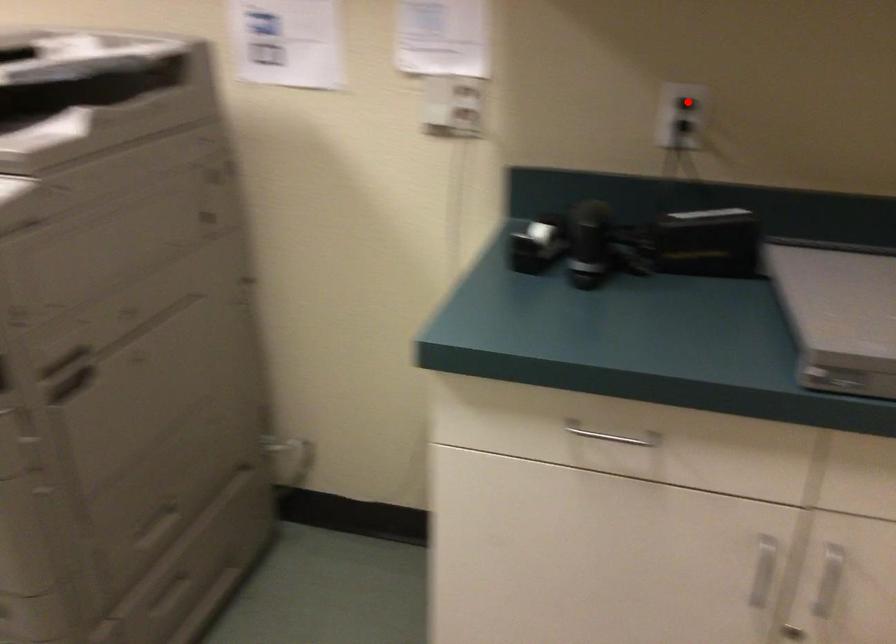
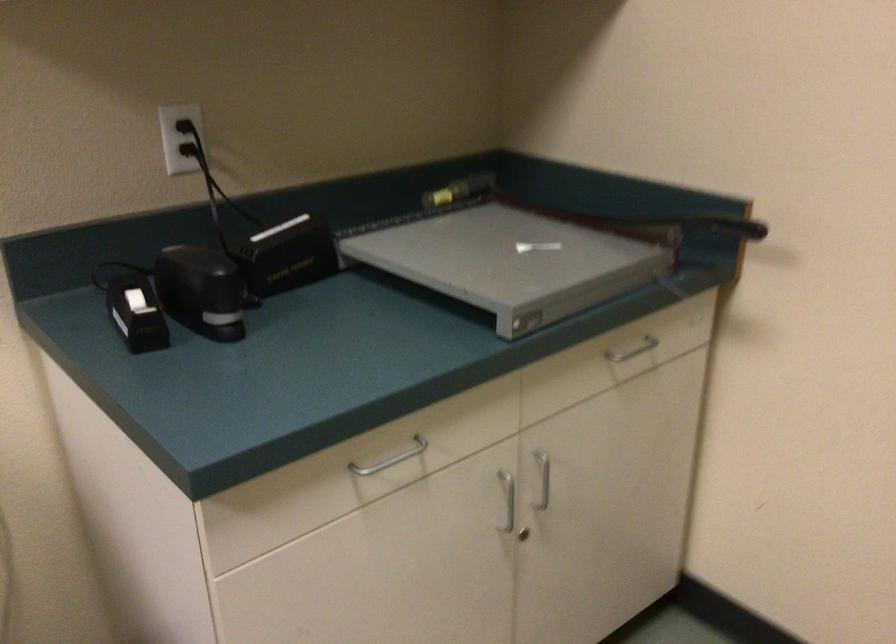
Where in the second image is the point corresponding to the highlighted location from the first image?

(186, 128)